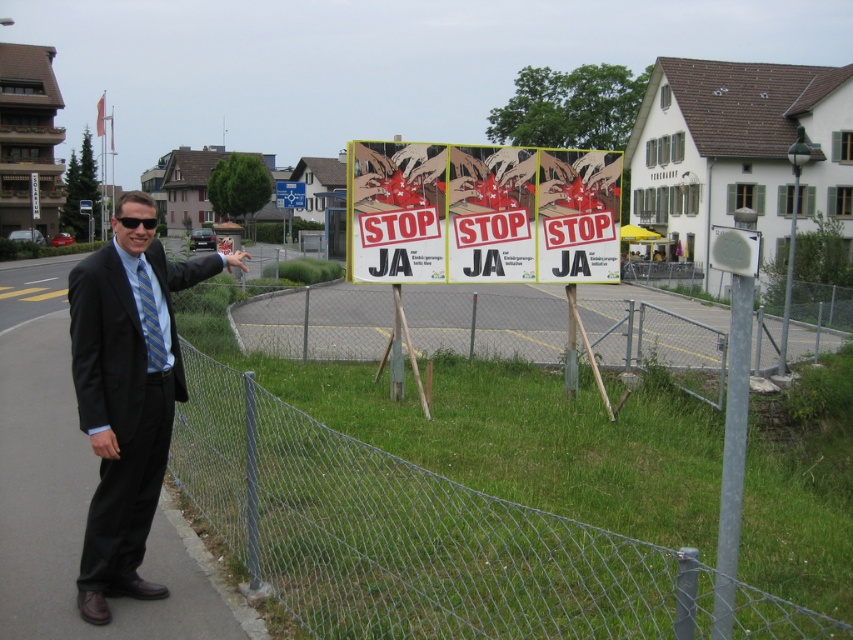
Question: Is the position of wire mesh fence at lower left more distant than that of matte paper poster at center?

Choices:
 (A) no
 (B) yes

Answer: (A)

Question: Which point is closer to the camera taking this photo?

Choices:
 (A) (577, 220)
 (B) (163, 365)
 (C) (115, 506)
 (D) (296, 198)

Answer: (C)

Question: Is blue striped tie at left to the left of blue plastic sign at upper center from the viewer's perspective?

Choices:
 (A) yes
 (B) no

Answer: (B)

Question: Which point appears farthest from the camera in this image?

Choices:
 (A) (430, 611)
 (B) (148, 362)
 (C) (169, 424)

Answer: (C)

Question: Estimate the real-world distances between objects in this image. Which object is farther from the blue striped tie at left?

Choices:
 (A) matte paper poster at center
 (B) black suit at left
 (C) wire mesh fence at lower left
 (D) blue plastic sign at upper center

Answer: (D)

Question: Where is blue striped tie at left located in relation to blue plastic sign at upper center in the image?

Choices:
 (A) right
 (B) left

Answer: (A)